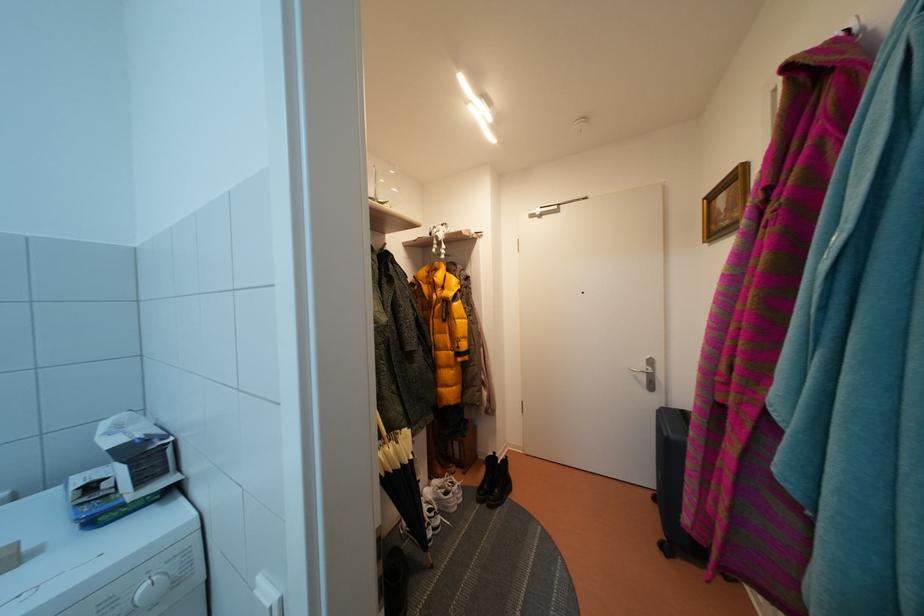
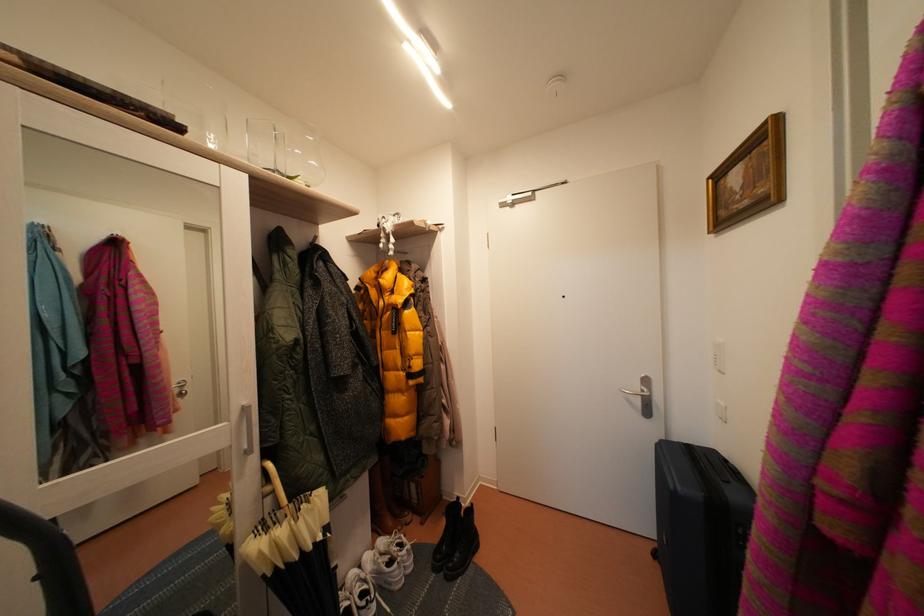
Where in the second image is the point corresponding to (x=444, y=506) from the first image?

(384, 578)